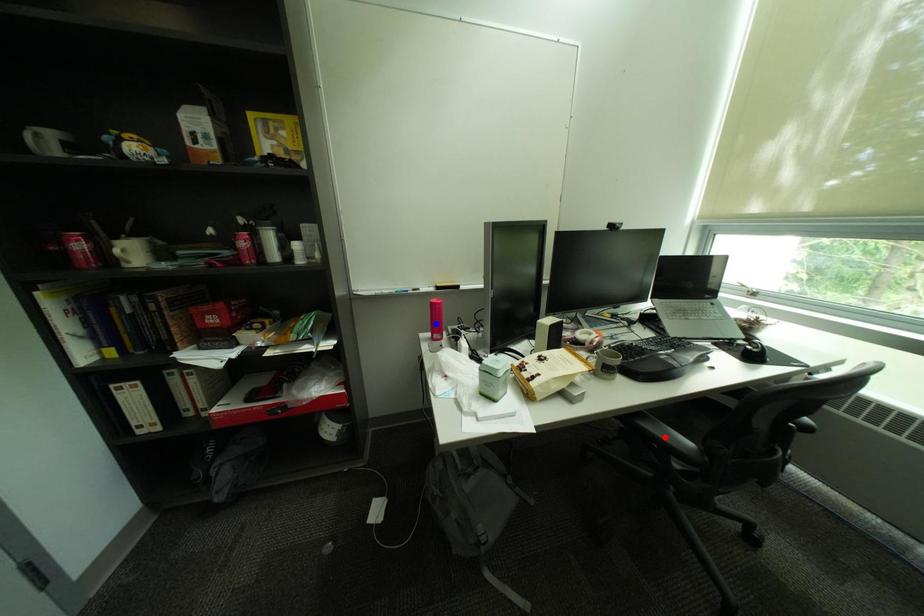
Question: Two points are marked on the image. Which point is closer to the camera?

Choices:
 (A) Blue point is closer.
 (B) Red point is closer.

Answer: (B)